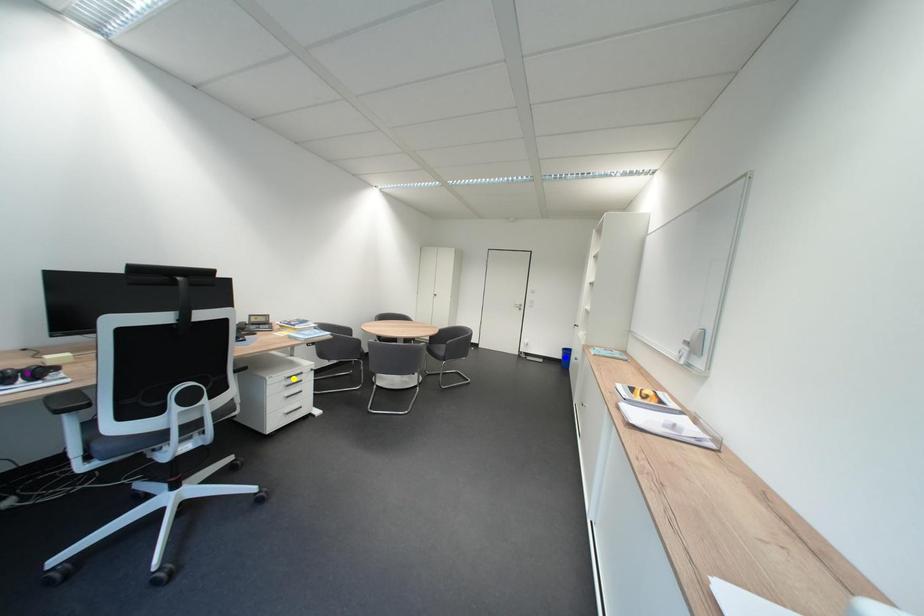
Order these from farthest to nearest:
A) blue point
B) yellow point
C) purple point

Answer: blue point, yellow point, purple point